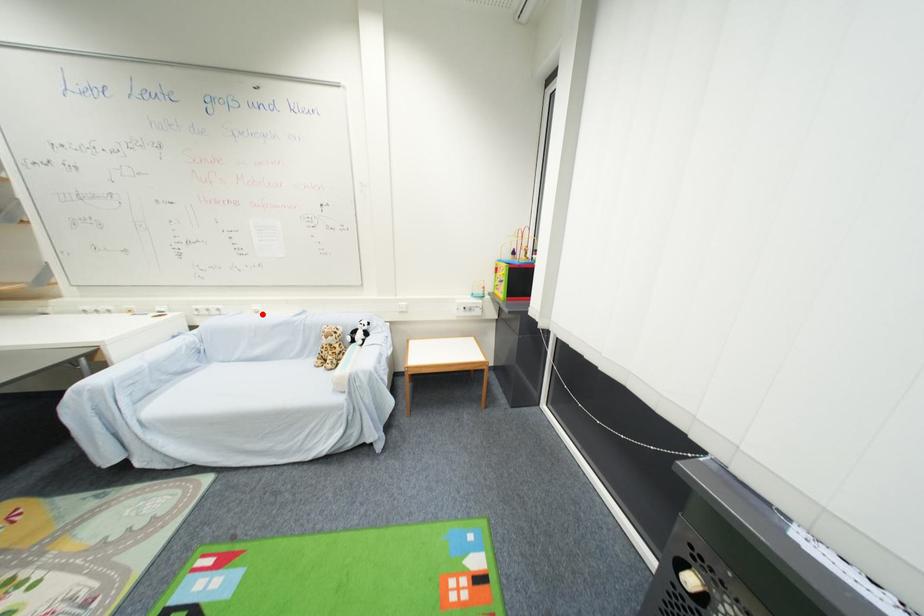
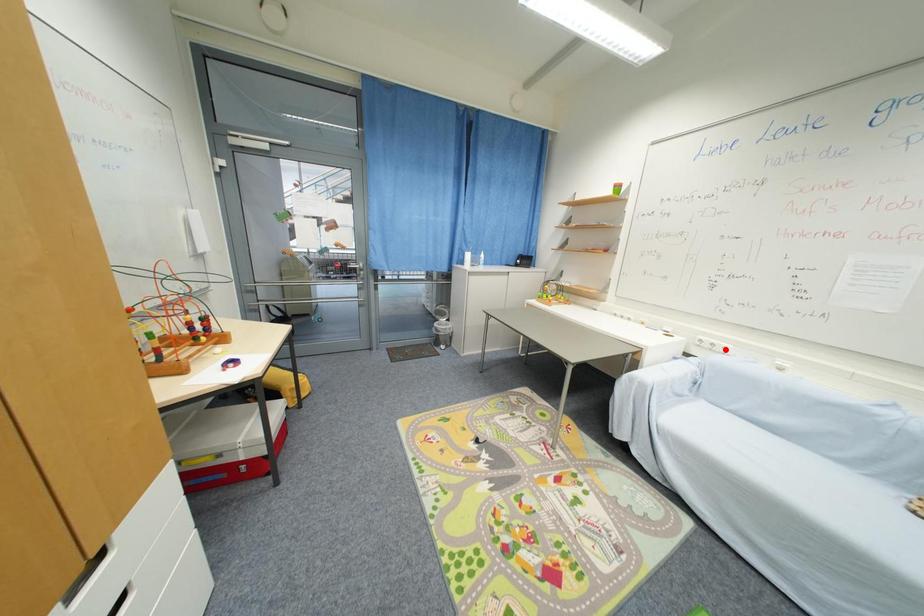
I am providing you with two images of the same scene from different viewpoints. A red point is marked on the first image and another point is marked on the second image. Is the marked point in image1 the same physical position as the marked point in image2?

No